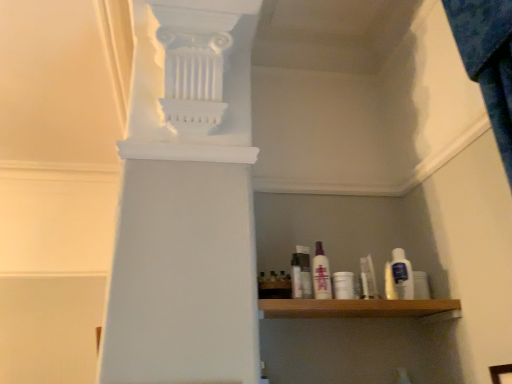
Question: Is clear plastic bag at center, the second toiletry when ordered from right to left, a part of clear plastic bottle at center?

Choices:
 (A) no
 (B) yes

Answer: (A)

Question: From the image's perspective, does clear plastic bottle at center appear higher than clear plastic bag at center, positioned as the fourth toiletry in left-to-right order?

Choices:
 (A) yes
 (B) no

Answer: (A)

Question: Is clear plastic bottle at center aimed at clear plastic bag at center, the second toiletry when ordered from right to left?

Choices:
 (A) yes
 (B) no

Answer: (B)

Question: Is clear plastic bottle at center outside of clear plastic bag at center, the second toiletry when ordered from right to left?

Choices:
 (A) no
 (B) yes

Answer: (B)

Question: Does clear plastic bottle at center have a lesser height compared to clear plastic bag at center, the second toiletry when ordered from right to left?

Choices:
 (A) no
 (B) yes

Answer: (A)

Question: Which is correct: clear plastic bottle at center is inside translucent purple bottle at center, placed as the 2th toiletry when sorted from left to right, or outside of it?

Choices:
 (A) outside
 (B) inside

Answer: (A)

Question: Is clear plastic bottle at center taller or shorter than translucent purple bottle at center, which is the fourth toiletry in right-to-left order?

Choices:
 (A) tall
 (B) short

Answer: (B)

Question: From the image's perspective, is clear plastic bottle at center positioned above or below translucent purple bottle at center, placed as the 2th toiletry when sorted from left to right?

Choices:
 (A) below
 (B) above

Answer: (A)

Question: Is clear plastic bottle at center in front of or behind translucent purple bottle at center, which is the fourth toiletry in right-to-left order, in the image?

Choices:
 (A) behind
 (B) front

Answer: (A)

Question: From a real-world perspective, is white plastic bottle at right, which is the 5th toiletry from left to right, positioned above or below white plastic cup at center, which is the 3th toiletry from left to right?

Choices:
 (A) above
 (B) below

Answer: (A)

Question: Would you say white plastic bottle at right, which is the 5th toiletry from left to right, is to the left or to the right of white plastic cup at center, which is the third toiletry from right to left, in the picture?

Choices:
 (A) right
 (B) left

Answer: (A)

Question: Considering their positions, is white plastic bottle at right, which appears as the 1th toiletry when viewed from the right, located in front of or behind white plastic cup at center, which is the 3th toiletry from left to right?

Choices:
 (A) behind
 (B) front

Answer: (A)

Question: From the image's perspective, is white plastic bottle at right, which appears as the 1th toiletry when viewed from the right, above or below white plastic cup at center, which is the 3th toiletry from left to right?

Choices:
 (A) below
 (B) above

Answer: (B)

Question: Is white plastic bottle at center, the fifth toiletry from the right, bigger or smaller than translucent purple bottle at center, which is the fourth toiletry in right-to-left order?

Choices:
 (A) big
 (B) small

Answer: (B)

Question: From the image's perspective, is white plastic bottle at center, which ranks as the 1th toiletry in left-to-right order, located above or below translucent purple bottle at center, placed as the 2th toiletry when sorted from left to right?

Choices:
 (A) above
 (B) below

Answer: (B)